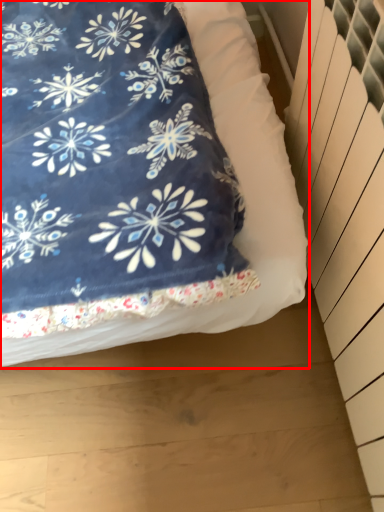
Question: In this image, where is bed (annotated by the red box) located relative to radiator?

Choices:
 (A) left
 (B) right

Answer: (A)